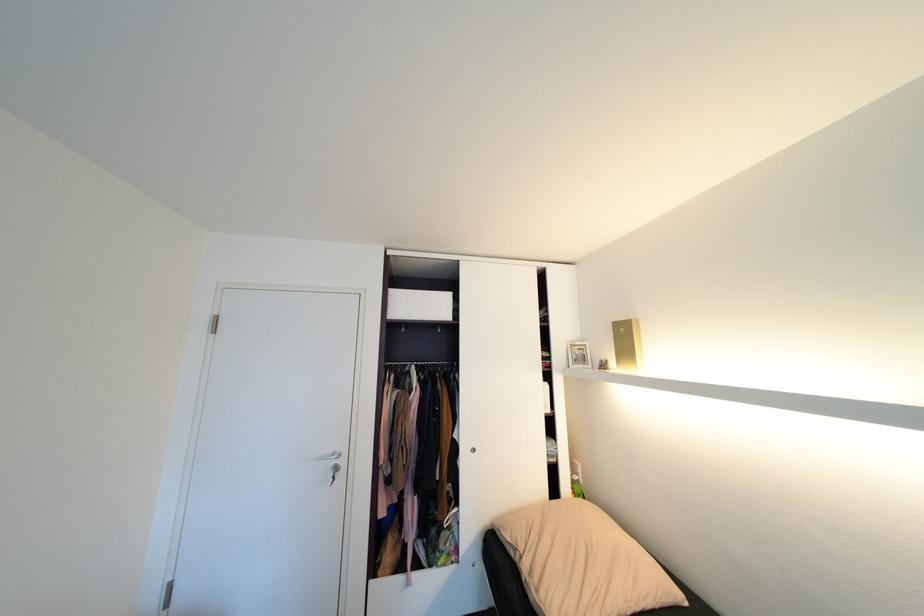
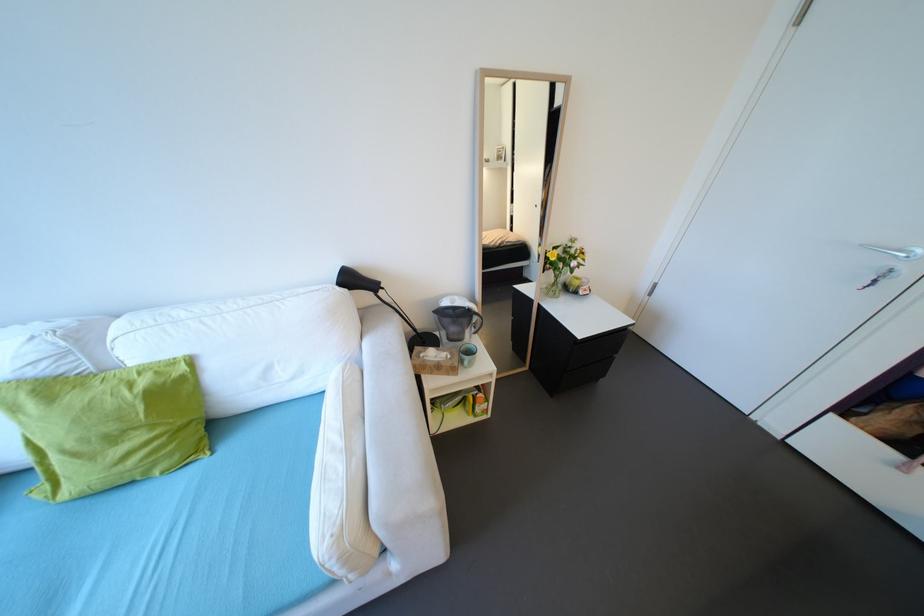
Based on the photo, based on the continuous images, in which direction is the camera rotating?

The camera's rotation is toward left-down.